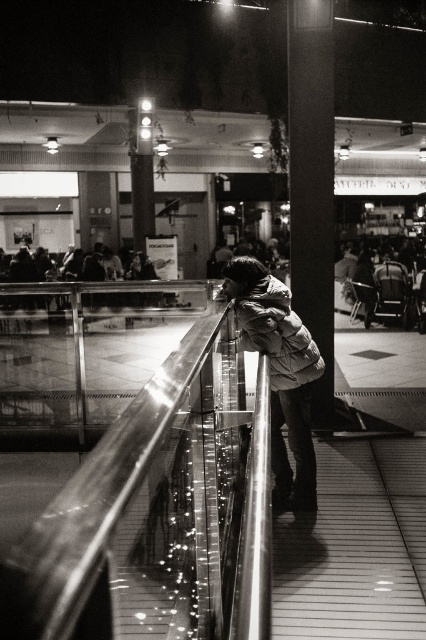
Does smooth concrete pillar at center appear on the right side of white puffy jacket at center?

Correct, you'll find smooth concrete pillar at center to the right of white puffy jacket at center.

Between smooth concrete pillar at center and white puffy jacket at center, which one appears on the left side from the viewer's perspective?

white puffy jacket at center

Does point (302, 172) come closer to viewer compared to point (279, 360)?

No, it is behind (279, 360).

Where is `smooth concrete pillar at center`? smooth concrete pillar at center is located at coordinates (311, 179).